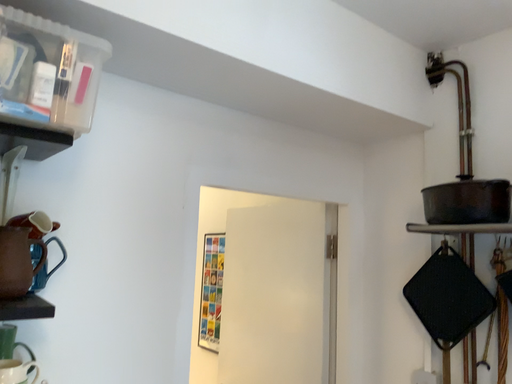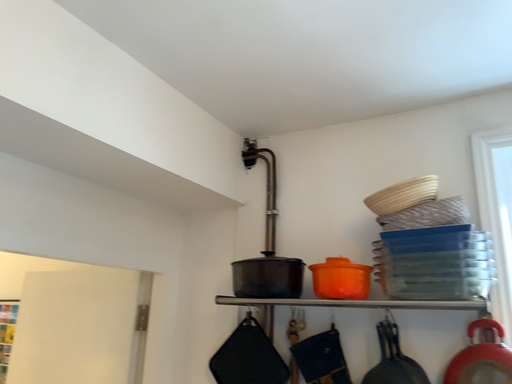
Question: Which way did the camera rotate in the video?

Choices:
 (A) rotated right
 (B) rotated left

Answer: (A)